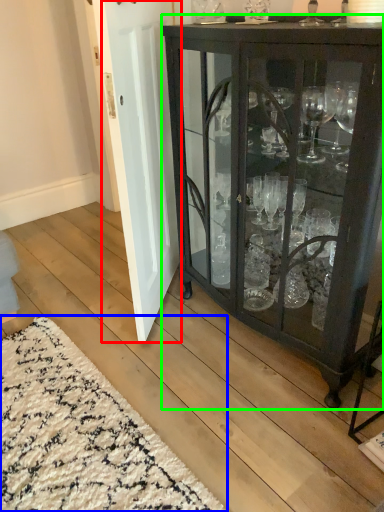
Question: Which is nearer to the door (highlighted by a red box)? doormat (highlighted by a blue box) or cupboard (highlighted by a green box).

Choices:
 (A) doormat
 (B) cupboard

Answer: (B)